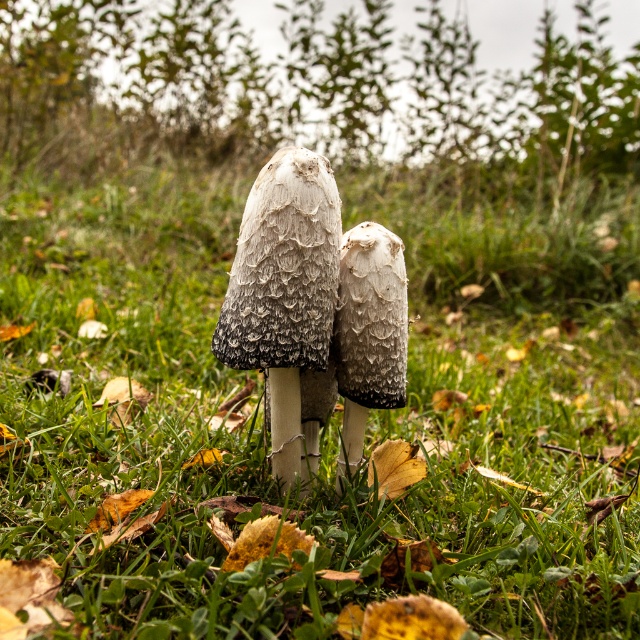
Between fuzzy white mushroom at center and fuzzy gray mushroom at center, which one is positioned higher?

fuzzy white mushroom at center is above.

Is the position of fuzzy white mushroom at center more distant than that of fuzzy gray mushroom at center?

No.

Between point (288, 193) and point (333, 324), which one is positioned in front?

Point (288, 193)

The width and height of the screenshot is (640, 640). In order to click on fuzzy white mushroom at center in this screenshot , I will do `click(285, 298)`.